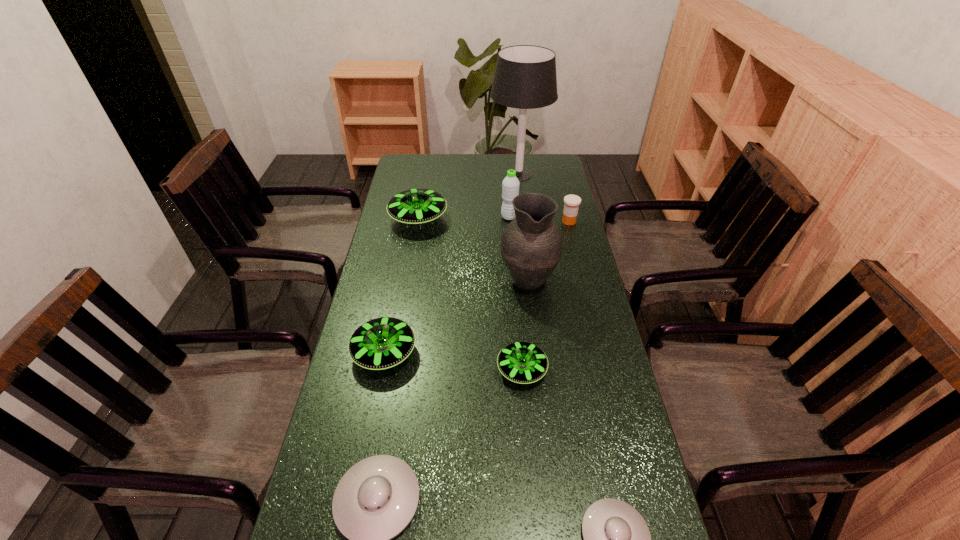
Select which object is the closest to the pitcher. Please provide its 2D coordinates. Your answer should be formatted as a tuple, i.e. [(x, y)], where the tuple contains the x and y coordinates of a point satisfying the conditions above.

[(571, 202)]

The width and height of the screenshot is (960, 540). Find the location of `object that ranks as the third closest to the farthest object`. object that ranks as the third closest to the farthest object is located at coordinates (571, 202).

Locate an element on the screen. the closest saucer to the second saucer from right to left is located at coordinates (381, 343).

This screenshot has width=960, height=540. I want to click on saucer that is the third closest one to the smallest green saucer, so click(x=617, y=539).

Find the location of a particular element. Image resolution: width=960 pixels, height=540 pixels. green saucer that is the second closest to the farthest saucer is located at coordinates (521, 362).

Locate which green saucer is the third closest to the green water bottle. Please provide its 2D coordinates. Your answer should be formatted as a tuple, i.e. [(x, y)], where the tuple contains the x and y coordinates of a point satisfying the conditions above.

[(521, 362)]